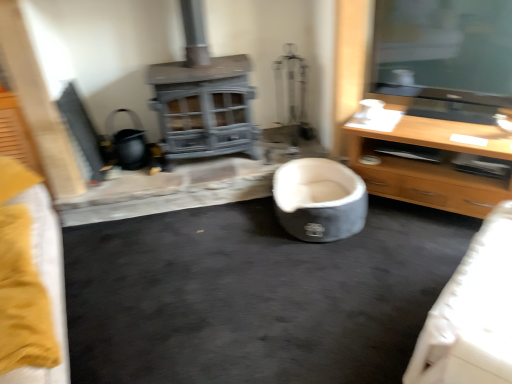
Question: Relative to soft gray fabric bean bag at center, is light wood/finish tv stand at right in front or behind?

Choices:
 (A) behind
 (B) front

Answer: (B)

Question: In terms of size, does light wood/finish tv stand at right appear bigger or smaller than soft gray fabric bean bag at center?

Choices:
 (A) small
 (B) big

Answer: (B)

Question: From the image's perspective, is light wood/finish tv stand at right positioned above or below soft gray fabric bean bag at center?

Choices:
 (A) below
 (B) above

Answer: (B)

Question: Is soft gray fabric bean bag at center taller or shorter than light wood/finish tv stand at right?

Choices:
 (A) tall
 (B) short

Answer: (B)

Question: Considering their positions, is soft gray fabric bean bag at center located in front of or behind light wood/finish tv stand at right?

Choices:
 (A) front
 (B) behind

Answer: (B)

Question: From a real-world perspective, relative to light wood/finish tv stand at right, is soft gray fabric bean bag at center vertically above or below?

Choices:
 (A) above
 (B) below

Answer: (B)

Question: Is soft gray fabric bean bag at center situated inside light wood/finish tv stand at right or outside?

Choices:
 (A) inside
 (B) outside

Answer: (B)